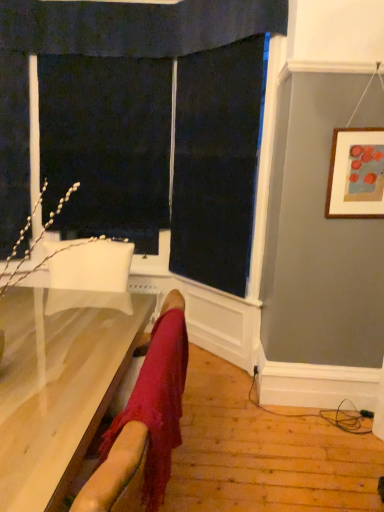
Question: Considering the relative sizes of black fabric screen door at upper left and light wood table at lower left in the image provided, is black fabric screen door at upper left thinner than light wood table at lower left?

Choices:
 (A) no
 (B) yes

Answer: (B)

Question: Is black fabric screen door at upper left facing away from light wood table at lower left?

Choices:
 (A) no
 (B) yes

Answer: (A)

Question: Is black fabric screen door at upper left far away from light wood table at lower left?

Choices:
 (A) no
 (B) yes

Answer: (B)

Question: Is black fabric screen door at upper left wider than light wood table at lower left?

Choices:
 (A) no
 (B) yes

Answer: (A)

Question: From the image's perspective, is black fabric screen door at upper left below light wood table at lower left?

Choices:
 (A) yes
 (B) no

Answer: (B)

Question: From the image's perspective, relative to wooden framed artwork at upper right, is black fabric screen door at upper left above or below?

Choices:
 (A) above
 (B) below

Answer: (A)

Question: Which is correct: black fabric screen door at upper left is inside wooden framed artwork at upper right, or outside of it?

Choices:
 (A) inside
 (B) outside

Answer: (B)

Question: Looking at their shapes, would you say black fabric screen door at upper left is wider or thinner than wooden framed artwork at upper right?

Choices:
 (A) wide
 (B) thin

Answer: (A)

Question: Is black fabric screen door at upper left to the left or to the right of wooden framed artwork at upper right in the image?

Choices:
 (A) left
 (B) right

Answer: (A)

Question: Is light wood table at lower left to the left or to the right of black fabric screen door at upper left in the image?

Choices:
 (A) right
 (B) left

Answer: (B)

Question: In the image, is light wood table at lower left positioned in front of or behind black fabric screen door at upper left?

Choices:
 (A) behind
 (B) front

Answer: (B)

Question: Is light wood table at lower left wider or thinner than black fabric screen door at upper left?

Choices:
 (A) thin
 (B) wide

Answer: (B)

Question: Is light wood table at lower left bigger or smaller than black fabric screen door at upper left?

Choices:
 (A) big
 (B) small

Answer: (A)

Question: Does point (364, 181) appear closer or farther from the camera than point (135, 327)?

Choices:
 (A) closer
 (B) farther

Answer: (B)

Question: From the image's perspective, relative to light wood table at lower left, is wooden framed artwork at upper right above or below?

Choices:
 (A) below
 (B) above

Answer: (B)